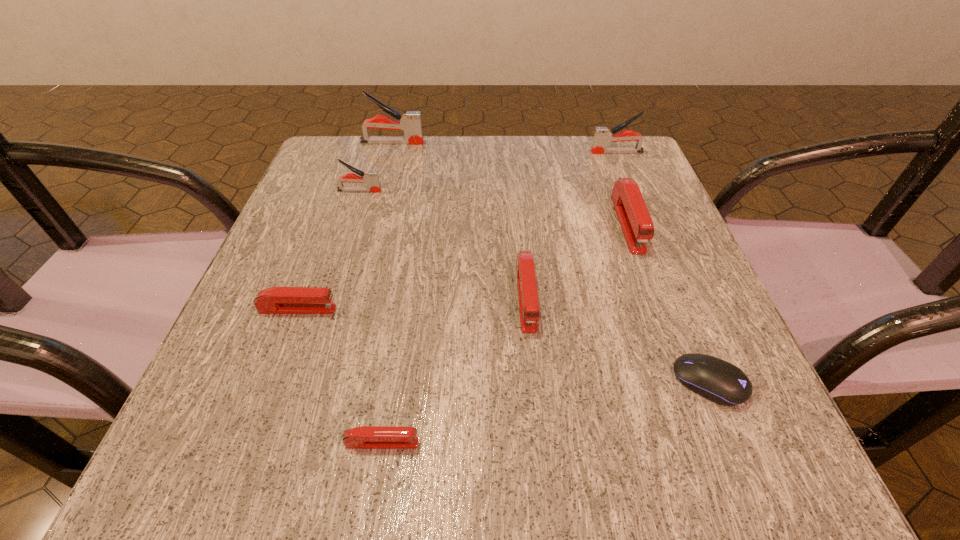
You are a GUI agent. You are given a task and a screenshot of the screen. Output one action in this format:
    pyautogui.click(x=<x>, y=<y>)
    Task: Click on the vacant space positioned on the handle side of the sixth nearest object
    This screenshot has width=960, height=540.
    Given the screenshot: What is the action you would take?
    pyautogui.click(x=457, y=191)

The width and height of the screenshot is (960, 540). I want to click on vacant region located on the front-facing side of the fourth farthest object, so click(660, 311).

At what (x,y) coordinates should I click in order to perform the action: click on free space located 0.220m on the front-facing side of the fifth stapler from left to right. Please return your answer as a coordinate pair (x, y). Image resolution: width=960 pixels, height=540 pixels. Looking at the image, I should click on (544, 485).

I want to click on free space located on the front-facing side of the leftmost red stapler, so click(x=512, y=309).

You are a GUI agent. You are given a task and a screenshot of the screen. Output one action in this format:
    pyautogui.click(x=<x>, y=<y>)
    Task: Click on the free location located 0.150m on the front-facing side of the nearest stapler
    This screenshot has width=960, height=540.
    Given the screenshot: What is the action you would take?
    pyautogui.click(x=539, y=443)

The image size is (960, 540). In order to click on vacant position located on the back of the second nearest object in this screenshot , I will do point(633,194).

Where is `object that is at the near edge`? This screenshot has width=960, height=540. object that is at the near edge is located at coordinates (365, 437).

Where is `computer mouse located at the right edge`? computer mouse located at the right edge is located at coordinates (719, 381).

Locate an element on the screen. object that is at the far right corner is located at coordinates coord(602,136).

Find the location of `free region at the far edge`. free region at the far edge is located at coordinates (548, 170).